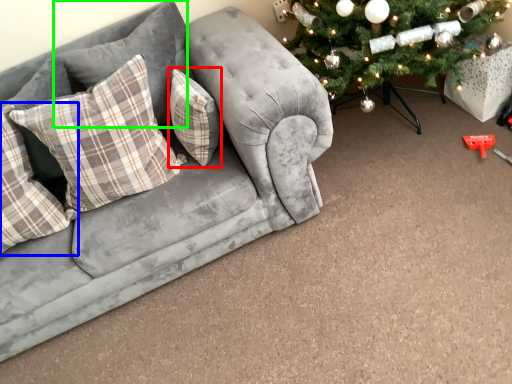
Question: Considering the real-world distances, which object is closest to pillow (highlighted by a red box)? pillow (highlighted by a blue box) or pillow (highlighted by a green box).

Choices:
 (A) pillow
 (B) pillow

Answer: (B)